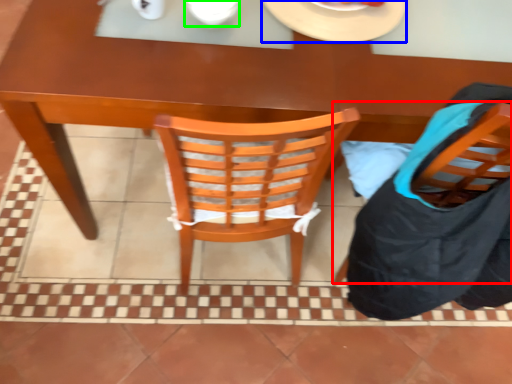
Question: Which object is positioned closest to chair (highlighted by a red box)? Select from plate (highlighted by a blue box) and tableware (highlighted by a green box).

Choices:
 (A) plate
 (B) tableware

Answer: (A)